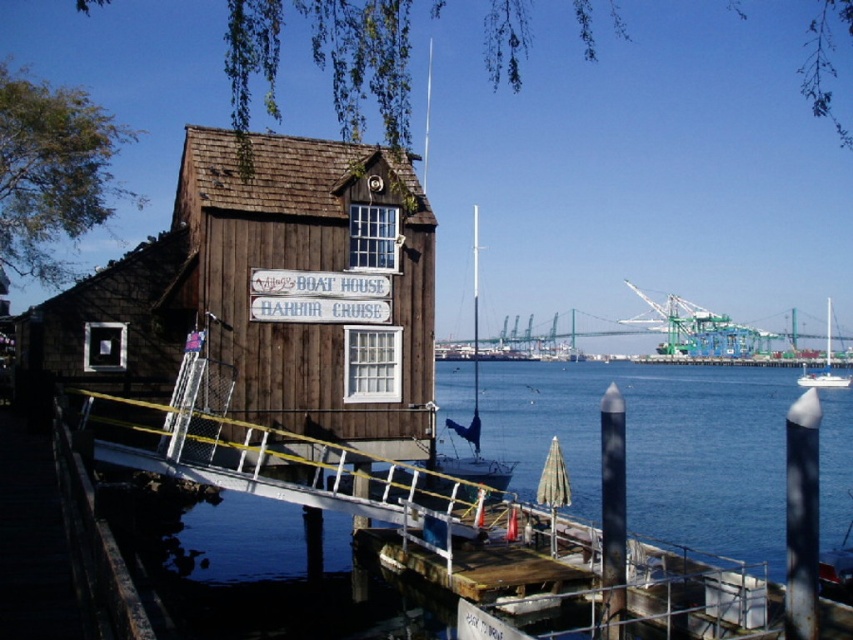
You are standing at the entrance of the boathouse and want to know the exact coordinates of the dark brown wood boat house at center. What are they?

The dark brown wood boat house at center is located at point [268,292].